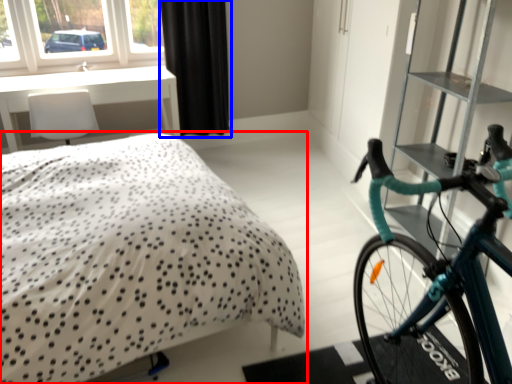
Question: Which object is closer to the camera taking this photo, bed (highlighted by a red box) or curtain (highlighted by a blue box)?

Choices:
 (A) bed
 (B) curtain

Answer: (A)